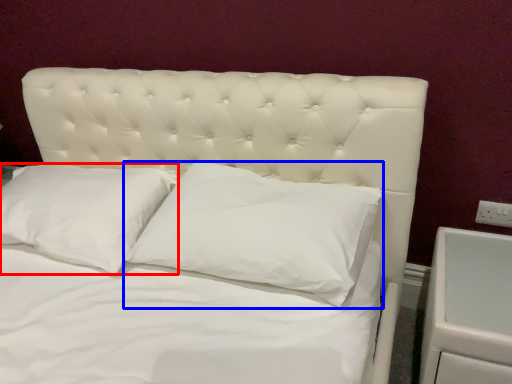
Question: Which point is further to the camera, pillow (highlighted by a red box) or pillow (highlighted by a blue box)?

Choices:
 (A) pillow
 (B) pillow

Answer: (A)